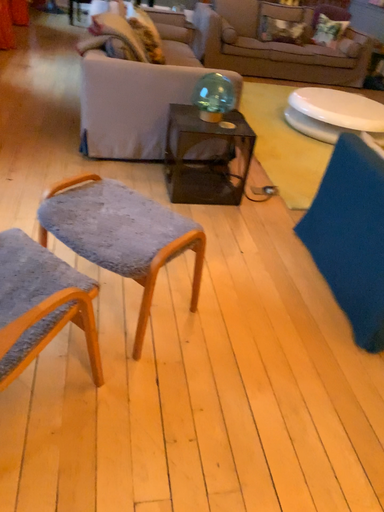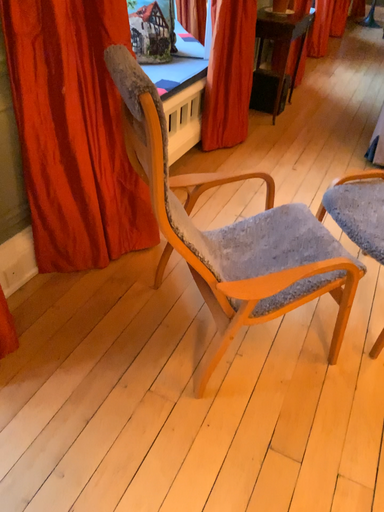
Question: How did the camera likely rotate when shooting the video?

Choices:
 (A) rotated upward
 (B) rotated downward

Answer: (A)